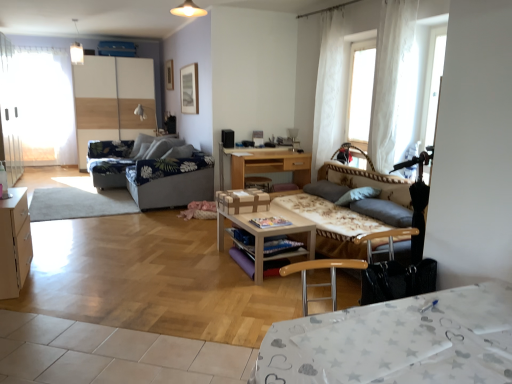
Question: Considering the relative positions of light wood cabinet at left and wooden table at center, the first table ordered from the bottom, in the image provided, is light wood cabinet at left to the right of wooden table at center, the first table ordered from the bottom, from the viewer's perspective?

Choices:
 (A) yes
 (B) no

Answer: (B)

Question: Considering the relative sizes of light wood cabinet at left and wooden table at center, the first table ordered from the bottom, in the image provided, is light wood cabinet at left thinner than wooden table at center, the first table ordered from the bottom,?

Choices:
 (A) yes
 (B) no

Answer: (A)

Question: Can you confirm if light wood cabinet at left is smaller than wooden table at center, which ranks as the 1th table in front-to-back order?

Choices:
 (A) no
 (B) yes

Answer: (B)

Question: Considering the relative sizes of light wood cabinet at left and wooden table at center, the second table viewed from the top, in the image provided, is light wood cabinet at left wider than wooden table at center, the second table viewed from the top,?

Choices:
 (A) yes
 (B) no

Answer: (B)

Question: From a real-world perspective, is light wood cabinet at left under wooden table at center, which ranks as the 1th table in front-to-back order?

Choices:
 (A) yes
 (B) no

Answer: (B)

Question: Is the surface of light wood cabinet at left in direct contact with wooden table at center, the first table ordered from the bottom?

Choices:
 (A) no
 (B) yes

Answer: (A)

Question: Is white glossy table at lower right oriented away from blue floral fabric studio couch at center-left, marked as the 1th studio couch in a back-to-front arrangement?

Choices:
 (A) no
 (B) yes

Answer: (A)

Question: Could blue floral fabric studio couch at center-left, which is the 2th studio couch in front-to-back order, be considered to be inside white glossy table at lower right?

Choices:
 (A) yes
 (B) no

Answer: (B)

Question: Is white glossy table at lower right at the right side of blue floral fabric studio couch at center-left, which appears as the 2th studio couch when viewed from the right?

Choices:
 (A) yes
 (B) no

Answer: (A)

Question: Is white glossy table at lower right closer to camera compared to blue floral fabric studio couch at center-left, which is the 2th studio couch in front-to-back order?

Choices:
 (A) no
 (B) yes

Answer: (B)

Question: Does white glossy table at lower right have a greater width compared to blue floral fabric studio couch at center-left, which is the 2th studio couch in front-to-back order?

Choices:
 (A) no
 (B) yes

Answer: (A)

Question: From the image's perspective, does white glossy table at lower right appear higher than blue floral fabric studio couch at center-left, which is counted as the 1th studio couch, starting from the left?

Choices:
 (A) yes
 (B) no

Answer: (B)

Question: Is floral fabric studio couch at center, the 2th studio couch from the left, bigger than white sheer curtain at upper right, the first curtain in the front-to-back sequence?

Choices:
 (A) yes
 (B) no

Answer: (A)